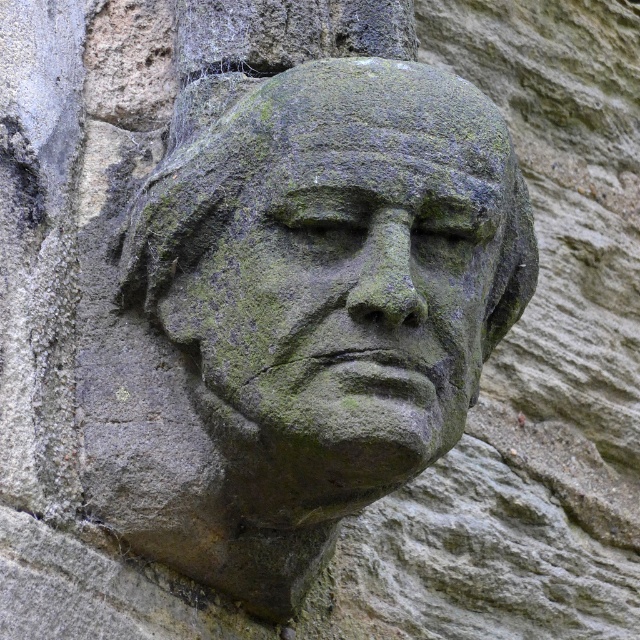
Who is more forward, (364, 282) or (278, 202)?

Point (364, 282) is more forward.

Consider the image. Can you confirm if green mossy stone head at center is positioned to the left of green mossy stone face at center?

Yes, green mossy stone head at center is to the left of green mossy stone face at center.

At what (x,y) coordinates should I click in order to perform the action: click on green mossy stone head at center. Please return your answer as a coordinate pair (x, y). This screenshot has width=640, height=640. Looking at the image, I should click on (337, 275).

You are a GUI agent. You are given a task and a screenshot of the screen. Output one action in this format:
    pyautogui.click(x=<x>, y=<y>)
    Task: Click on the green mossy stone head at center
    This screenshot has width=640, height=640.
    Given the screenshot: What is the action you would take?
    pyautogui.click(x=337, y=275)